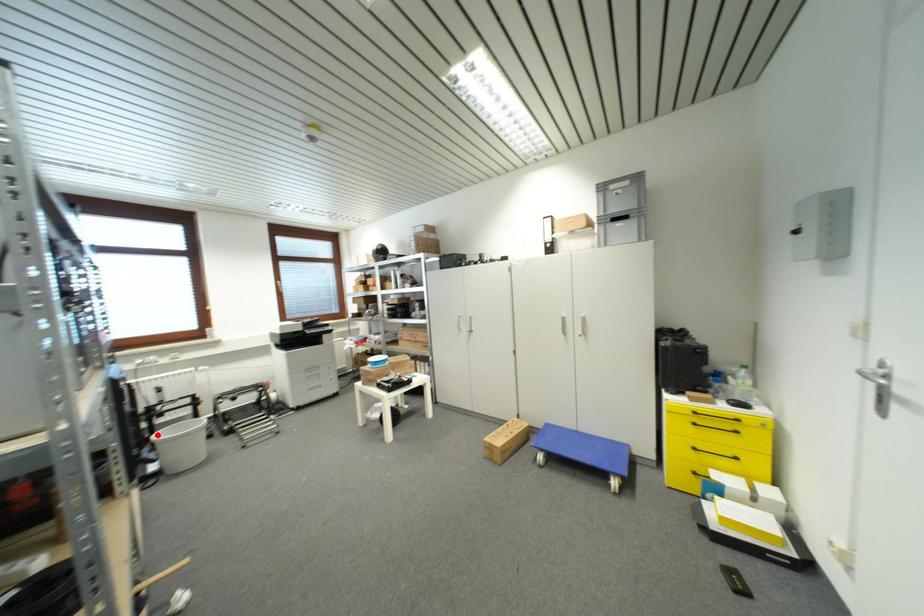
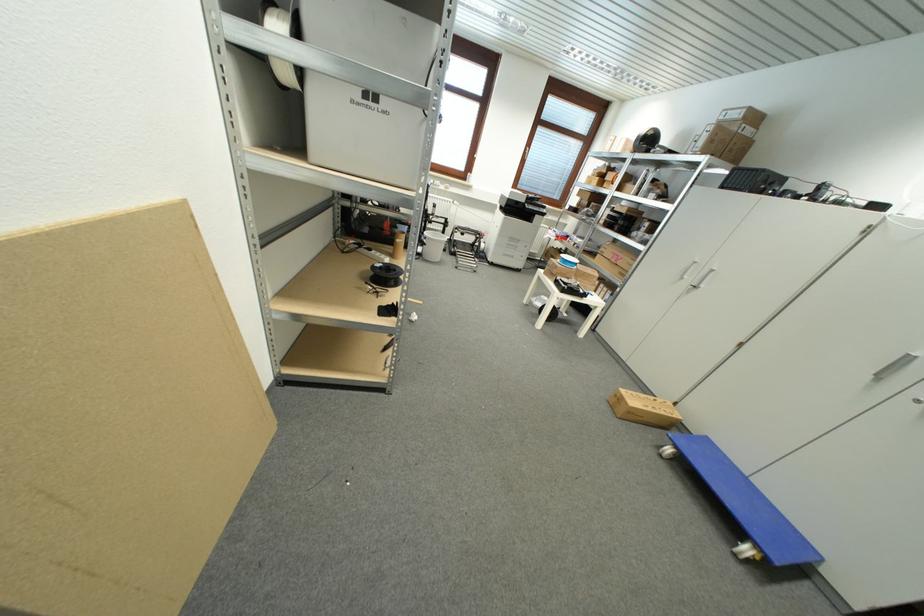
Question: I am providing you with two images of the same scene from different viewpoints. Image1 has a red point marked. In image2, the corresponding 3D location appears at what relative position? Reply with the corresponding letter.

Choices:
 (A) Closer
 (B) Farther

Answer: (A)